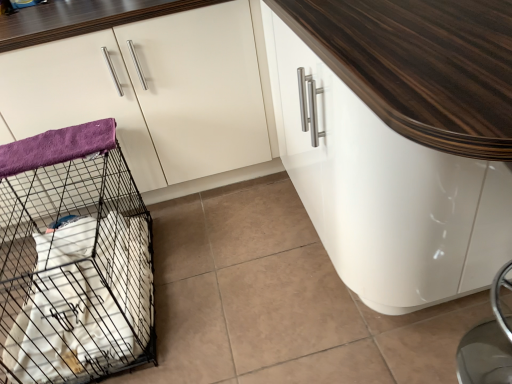
Question: Considering the relative sizes of white glossy cabinet at upper left, positioned as the 1th cabinetry in left-to-right order, and white glossy cabinet at center, which is counted as the first cabinetry, starting from the right, in the image provided, is white glossy cabinet at upper left, positioned as the 1th cabinetry in left-to-right order, wider than white glossy cabinet at center, which is counted as the first cabinetry, starting from the right,?

Choices:
 (A) yes
 (B) no

Answer: (B)

Question: Is white glossy cabinet at upper left, arranged as the 2th cabinetry when viewed from the right, in contact with white glossy cabinet at center, the 2th cabinetry viewed from the left?

Choices:
 (A) yes
 (B) no

Answer: (B)

Question: Does white glossy cabinet at upper left, positioned as the 1th cabinetry in left-to-right order, appear on the right side of white glossy cabinet at center, the 2th cabinetry viewed from the left?

Choices:
 (A) no
 (B) yes

Answer: (A)

Question: Does white glossy cabinet at upper left, positioned as the 1th cabinetry in left-to-right order, have a lesser height compared to white glossy cabinet at center, the 2th cabinetry viewed from the left?

Choices:
 (A) yes
 (B) no

Answer: (B)

Question: Is white glossy cabinet at upper left, positioned as the 1th cabinetry in left-to-right order, aimed at white glossy cabinet at center, the 2th cabinetry viewed from the left?

Choices:
 (A) yes
 (B) no

Answer: (B)

Question: Is white glossy cabinet at upper left, positioned as the 1th cabinetry in left-to-right order, spatially inside purple fleece blanket at left, or outside of it?

Choices:
 (A) outside
 (B) inside

Answer: (A)

Question: Is white glossy cabinet at upper left, positioned as the 1th cabinetry in left-to-right order, bigger or smaller than purple fleece blanket at left?

Choices:
 (A) big
 (B) small

Answer: (A)

Question: Considering the positions of point (170, 48) and point (7, 167), is point (170, 48) closer or farther from the camera than point (7, 167)?

Choices:
 (A) farther
 (B) closer

Answer: (A)

Question: From a real-world perspective, is white glossy cabinet at upper left, positioned as the 1th cabinetry in left-to-right order, positioned above or below purple fleece blanket at left?

Choices:
 (A) above
 (B) below

Answer: (B)

Question: Is black wire mesh cage at left spatially inside white glossy cabinet at upper left, arranged as the 2th cabinetry when viewed from the right, or outside of it?

Choices:
 (A) inside
 (B) outside

Answer: (B)

Question: In terms of height, does black wire mesh cage at left look taller or shorter compared to white glossy cabinet at upper left, positioned as the 1th cabinetry in left-to-right order?

Choices:
 (A) tall
 (B) short

Answer: (B)

Question: From the image's perspective, is black wire mesh cage at left located above or below white glossy cabinet at upper left, positioned as the 1th cabinetry in left-to-right order?

Choices:
 (A) above
 (B) below

Answer: (B)

Question: Considering the positions of black wire mesh cage at left and white glossy cabinet at upper left, positioned as the 1th cabinetry in left-to-right order, in the image, is black wire mesh cage at left bigger or smaller than white glossy cabinet at upper left, positioned as the 1th cabinetry in left-to-right order,?

Choices:
 (A) small
 (B) big

Answer: (A)

Question: Relative to white glossy cabinet at center, the 2th cabinetry viewed from the left, is purple fleece blanket at left in front or behind?

Choices:
 (A) behind
 (B) front

Answer: (A)

Question: From their relative heights in the image, would you say purple fleece blanket at left is taller or shorter than white glossy cabinet at center, the 2th cabinetry viewed from the left?

Choices:
 (A) short
 (B) tall

Answer: (A)